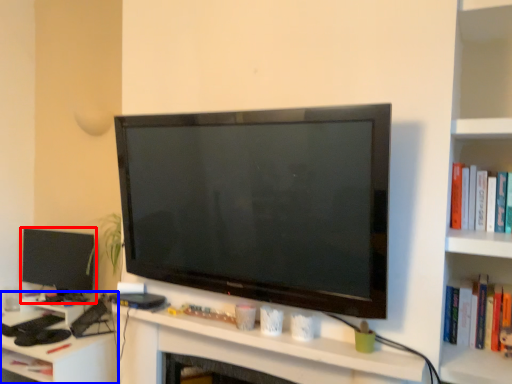
Question: Which object is closer to the camera taking this photo, television (highlighted by a red box) or computer desk (highlighted by a blue box)?

Choices:
 (A) television
 (B) computer desk

Answer: (B)